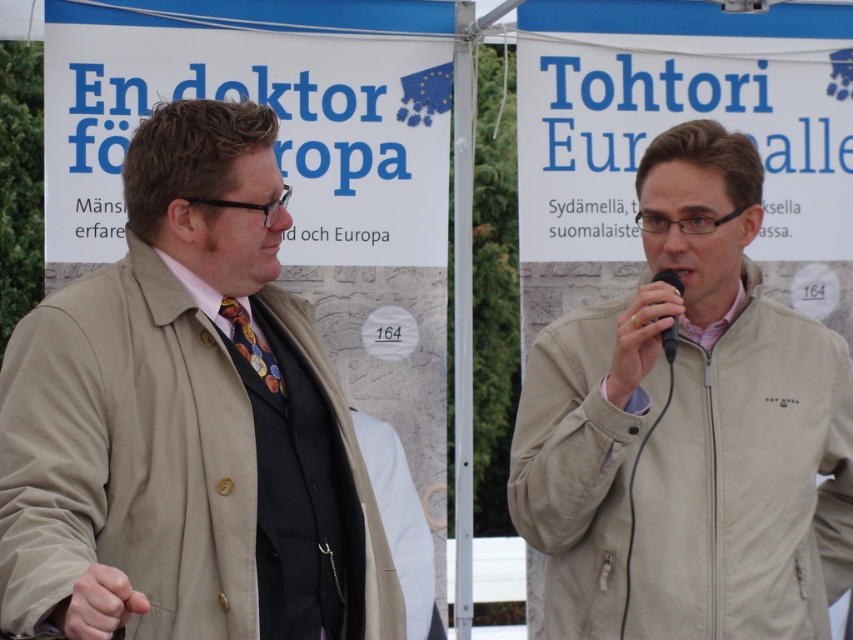
You are attending a conference and need to identify which beige clothing item is higher in the image. The beige fabric jacket at right and the beige fabric trench coat at left are both visible. Which one is positioned higher?

The beige fabric jacket at right is located above the beige fabric trench coat at left, so it is positioned higher.